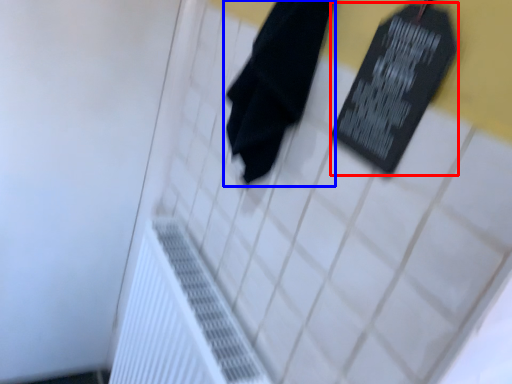
Question: Which object is closer to the camera taking this photo, bulletin board (highlighted by a red box) or towel (highlighted by a blue box)?

Choices:
 (A) bulletin board
 (B) towel

Answer: (A)